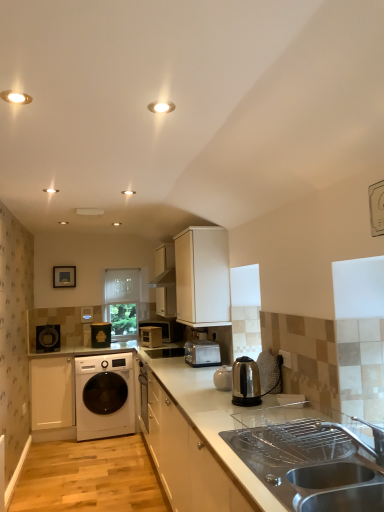
Find the location of a particular element. Image resolution: width=384 pixels, height=512 pixels. vacant space in front of stainless steel kettle at center, marked as the first home appliance in a right-to-left arrangement is located at coordinates (248, 414).